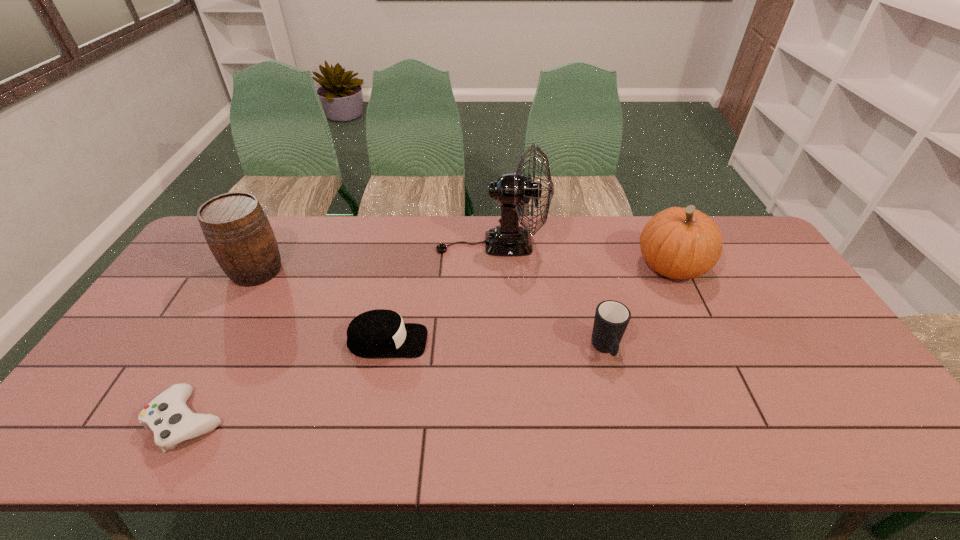
I want to click on free region that satisfies the following two spatial constraints: 1. in front of the fan, indicating the direction of air flow; 2. on the side of the cider near the bung hole, so click(492, 271).

This screenshot has height=540, width=960. Find the location of `vacant region that satisfies the following two spatial constraints: 1. on the stem of the rightmost object; 2. on the side of the cider near the bung hole`. vacant region that satisfies the following two spatial constraints: 1. on the stem of the rightmost object; 2. on the side of the cider near the bung hole is located at coordinates (673, 271).